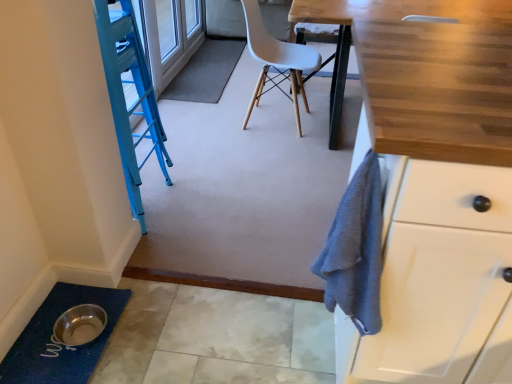
Question: Is white plastic chair at center at the left side of gray carpet at center, the 2th bath mat from the bottom?

Choices:
 (A) no
 (B) yes

Answer: (A)

Question: Can you confirm if white plastic chair at center is smaller than gray carpet at center, the 1th bath mat positioned from the top?

Choices:
 (A) yes
 (B) no

Answer: (B)

Question: Would you say white plastic chair at center contains gray carpet at center, which appears as the first bath mat when viewed from the back?

Choices:
 (A) yes
 (B) no

Answer: (B)

Question: From the image's perspective, is white plastic chair at center on gray carpet at center, which appears as the first bath mat when viewed from the back?

Choices:
 (A) no
 (B) yes

Answer: (A)

Question: From the image's perspective, does white plastic chair at center appear lower than gray carpet at center, which appears as the first bath mat when viewed from the back?

Choices:
 (A) yes
 (B) no

Answer: (A)

Question: Is white plastic chair at center facing away from gray carpet at center, which appears as the first bath mat when viewed from the back?

Choices:
 (A) yes
 (B) no

Answer: (B)

Question: Considering the relative positions of blue textured bath mat at lower left, positioned as the 1th bath mat in front-to-back order, and white plastic chair at center in the image provided, is blue textured bath mat at lower left, positioned as the 1th bath mat in front-to-back order, to the left of white plastic chair at center from the viewer's perspective?

Choices:
 (A) yes
 (B) no

Answer: (A)

Question: Does blue textured bath mat at lower left, positioned as the 1th bath mat in front-to-back order, have a greater height compared to white plastic chair at center?

Choices:
 (A) yes
 (B) no

Answer: (B)

Question: Is blue textured bath mat at lower left, the 1th bath mat ordered from the bottom, outside of white plastic chair at center?

Choices:
 (A) no
 (B) yes

Answer: (B)

Question: Is blue textured bath mat at lower left, the 2th bath mat in the top-to-bottom sequence, bigger than white plastic chair at center?

Choices:
 (A) no
 (B) yes

Answer: (A)

Question: Considering the relative sizes of blue textured bath mat at lower left, positioned as the 1th bath mat in front-to-back order, and white plastic chair at center in the image provided, is blue textured bath mat at lower left, positioned as the 1th bath mat in front-to-back order, shorter than white plastic chair at center?

Choices:
 (A) yes
 (B) no

Answer: (A)

Question: From a real-world perspective, is blue textured bath mat at lower left, the 1th bath mat ordered from the bottom, positioned over white plastic chair at center based on gravity?

Choices:
 (A) yes
 (B) no

Answer: (B)

Question: Does gray carpet at center, the 2th bath mat positioned from the front, have a greater height compared to blue textured bath mat at lower left, the 1th bath mat ordered from the bottom?

Choices:
 (A) yes
 (B) no

Answer: (B)